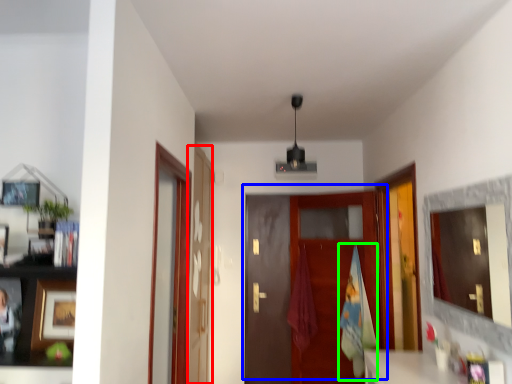
Question: Which object is the closest to the glass door (highlighted by a red box)? Choose among these: door (highlighted by a blue box) or bath towel (highlighted by a green box).

Choices:
 (A) door
 (B) bath towel

Answer: (A)